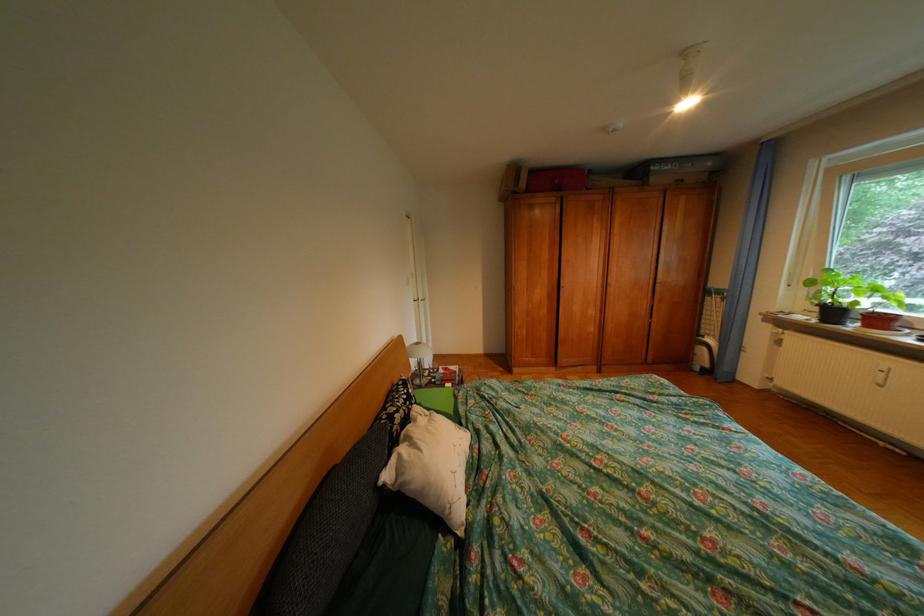
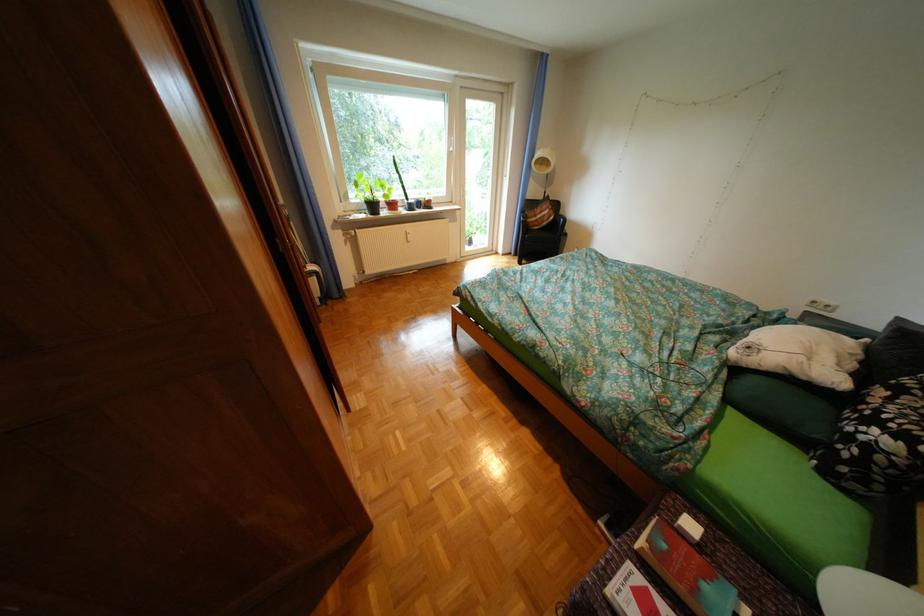
In the second image, find the point that corresponds to (x=411, y=411) in the first image.

(904, 399)